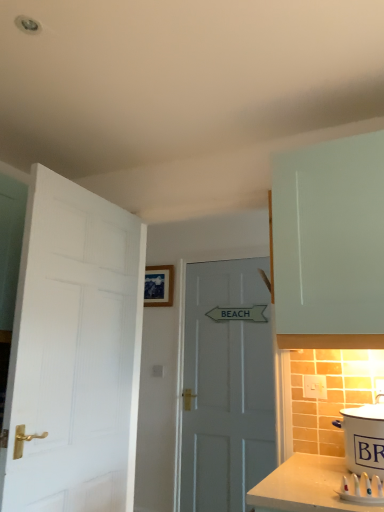
This screenshot has height=512, width=384. Identify the location of blank space situated above white wooden door at center, placed as the first door when sorted from back to front (from a real-world perspective). (233, 250).